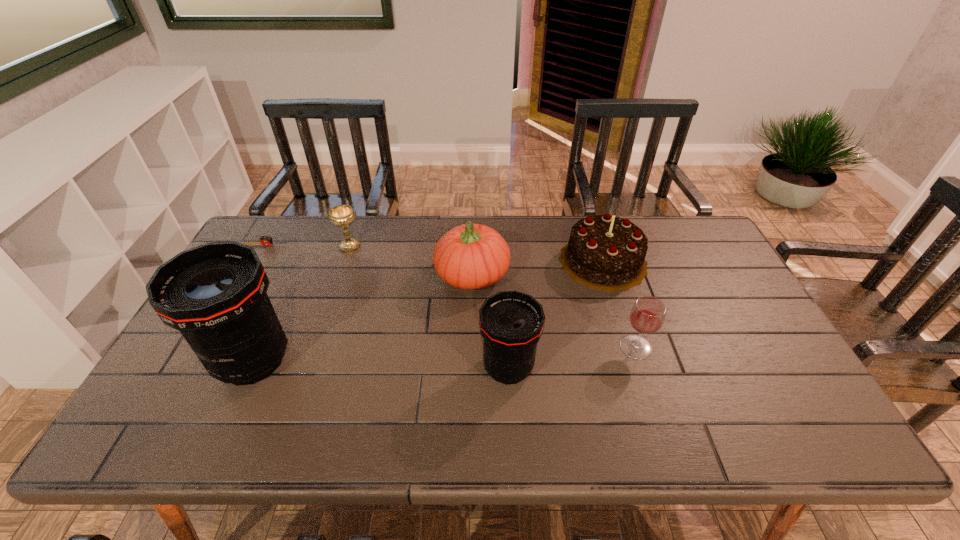
Find the location of a particular element. The image size is (960, 540). vacant area situated on the right of the shortest object is located at coordinates (335, 245).

In order to click on vacant area located on the left of the birthday cake in this screenshot , I will do `click(433, 261)`.

In order to click on vacant space situated on the right of the chalice in this screenshot , I will do click(x=431, y=246).

Find the location of a particular element. Image resolution: width=960 pixels, height=540 pixels. blank space located 0.150m on the right of the pumpkin is located at coordinates (558, 274).

The width and height of the screenshot is (960, 540). Find the location of `vacant space situated 0.260m on the left of the wineglass`. vacant space situated 0.260m on the left of the wineglass is located at coordinates (520, 347).

Locate an element on the screen. tape measure at the far edge is located at coordinates (265, 240).

Identify the location of birthday cake that is at the far edge. The image size is (960, 540). (604, 252).

Where is `chalice present at the far edge`? The width and height of the screenshot is (960, 540). chalice present at the far edge is located at coordinates pos(342,216).

At what (x,y) coordinates should I click in order to perform the action: click on pumpkin positioned at the far edge. Please return your answer as a coordinate pair (x, y). The height and width of the screenshot is (540, 960). Looking at the image, I should click on (470, 256).

Image resolution: width=960 pixels, height=540 pixels. Identify the location of telephoto lens that is at the left edge. (215, 294).